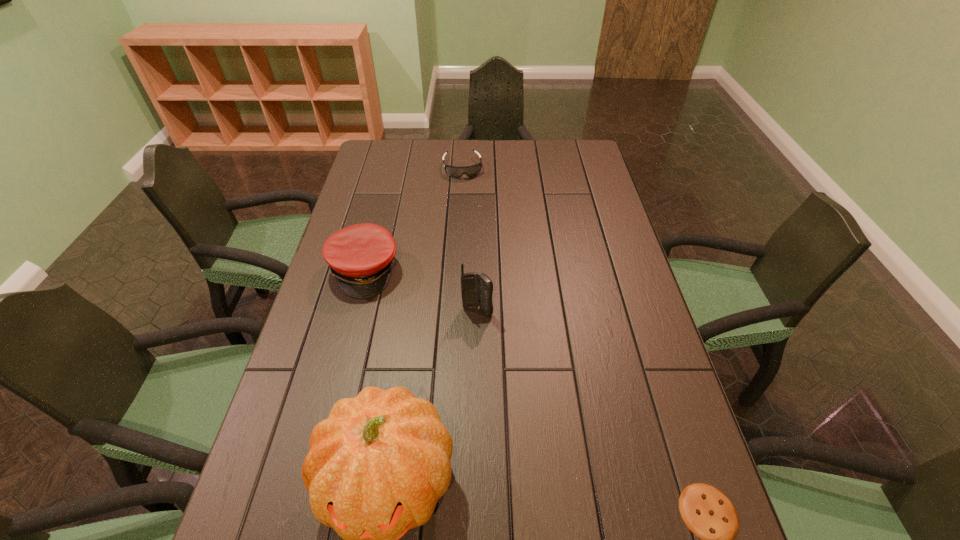
The height and width of the screenshot is (540, 960). In order to click on goggles in this screenshot , I will do `click(470, 171)`.

The height and width of the screenshot is (540, 960). What are the coordinates of `the fourth tallest object` in the screenshot? It's located at (470, 171).

In order to click on cap in this screenshot , I will do `click(360, 257)`.

Where is `the third shortest object`? the third shortest object is located at coordinates (360, 257).

Identify the location of the second tallest object. (476, 290).

Find the location of a particular element. The height and width of the screenshot is (540, 960). the third nearest object is located at coordinates (476, 290).

Identify the location of vacant space located on the front and sides of the farthest object. (469, 210).

The height and width of the screenshot is (540, 960). I want to click on free space located on the front and sides of the farthest object, so click(474, 239).

Locate an element on the screen. free spot located on the front and sides of the farthest object is located at coordinates (468, 203).

This screenshot has height=540, width=960. I want to click on vacant space located on the front of the third tallest object with an emblem, so click(x=408, y=344).